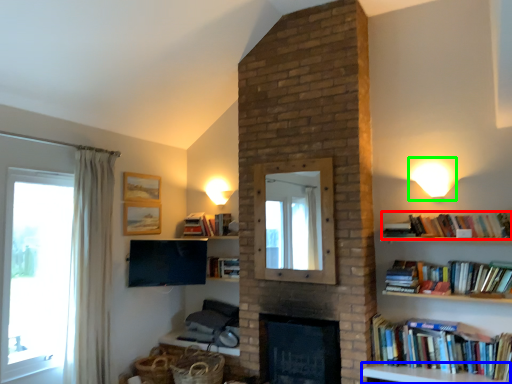
Question: Which object is the farthest from book (highlighted by a red box)? Choose among these: furniture (highlighted by a blue box) or light fixture (highlighted by a green box).

Choices:
 (A) furniture
 (B) light fixture

Answer: (A)